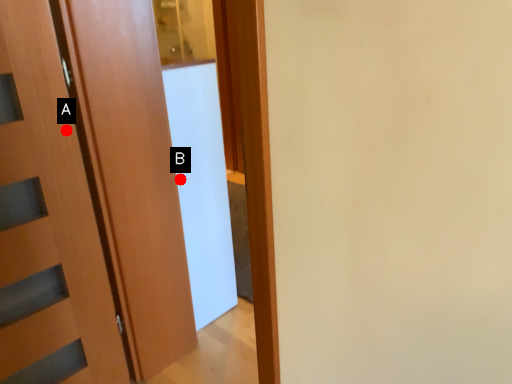
Question: Two points are circled on the image, labeled by A and B beside each circle. Which point is closer to the camera?

Choices:
 (A) A is closer
 (B) B is closer

Answer: (A)